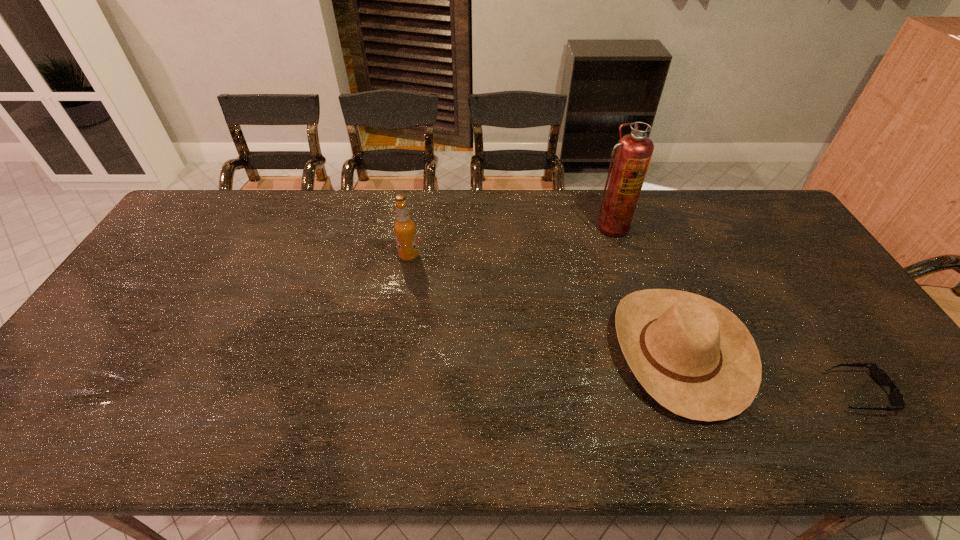
Find the location of a particular element. This screenshot has height=540, width=960. empty space between the second tallest object and the farthest object is located at coordinates [x=510, y=242].

Where is `free space between the second shortest object and the leftmost object`? The width and height of the screenshot is (960, 540). free space between the second shortest object and the leftmost object is located at coordinates (544, 303).

Locate an element on the screen. This screenshot has height=540, width=960. vacant area that lies between the second farthest object and the cowboy hat is located at coordinates (544, 303).

Where is `object that is the closest one to the farthest object`? This screenshot has height=540, width=960. object that is the closest one to the farthest object is located at coordinates (696, 358).

Point out which object is positioned as the nearest to the rightmost object. Please provide its 2D coordinates. Your answer should be formatted as a tuple, i.e. [(x, y)], where the tuple contains the x and y coordinates of a point satisfying the conditions above.

[(696, 358)]

The height and width of the screenshot is (540, 960). I want to click on vacant position in the image that satisfies the following two spatial constraints: 1. on the side of the tallest object with the label; 2. on the front label of the leftmost object, so click(619, 256).

Where is `vacant area in the image that satisfies the following two spatial constraints: 1. on the side of the farthest object with the label; 2. on the front label of the second tallest object`? vacant area in the image that satisfies the following two spatial constraints: 1. on the side of the farthest object with the label; 2. on the front label of the second tallest object is located at coordinates (619, 256).